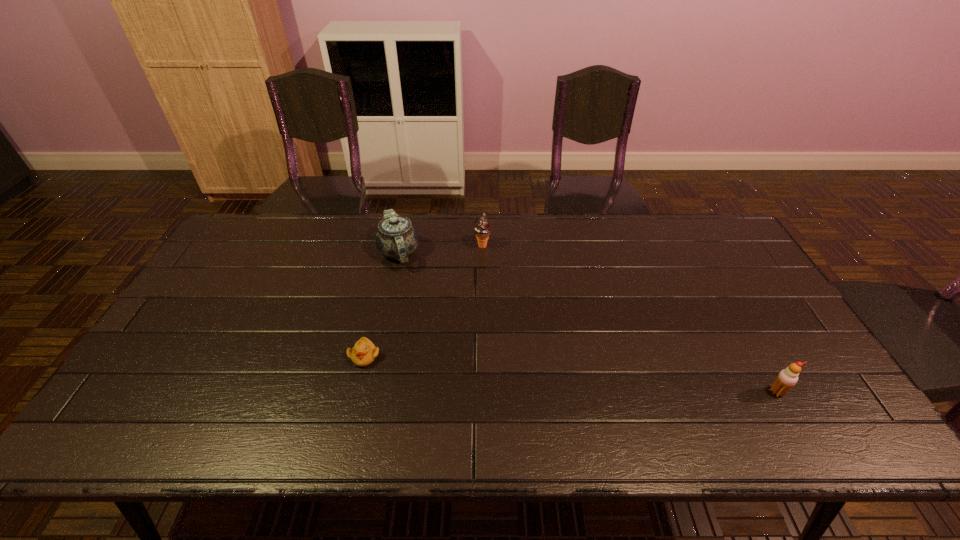
The image size is (960, 540). Find the location of `free space between the farther icecream and the chinaware`. free space between the farther icecream and the chinaware is located at coordinates (441, 249).

At what (x,y) coordinates should I click in order to perform the action: click on object identified as the third closest to the chinaware. Please return your answer as a coordinate pair (x, y). Looking at the image, I should click on (787, 378).

I want to click on the second closest object to the left icecream, so click(364, 352).